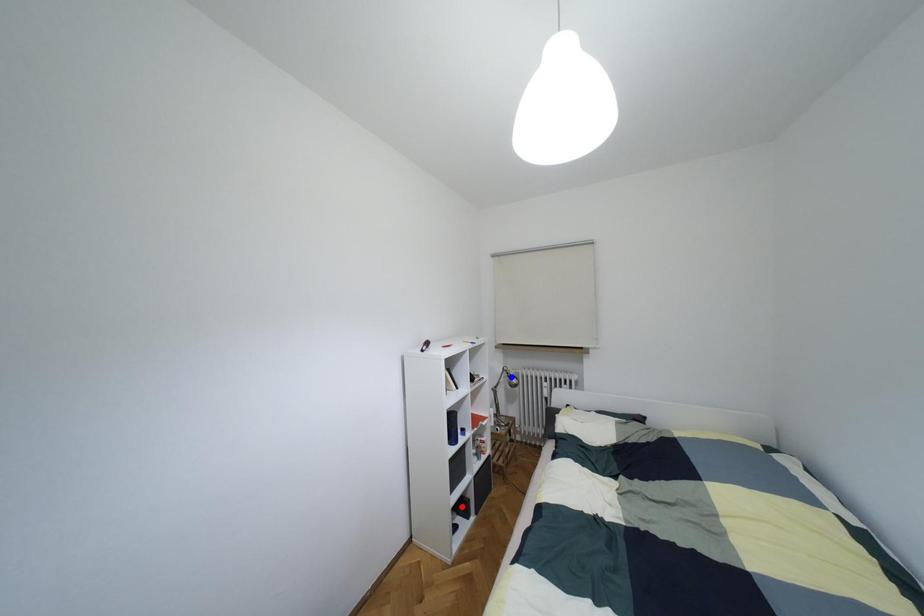
Question: Which of the two points in the image is closer to the camera?

Choices:
 (A) Blue point is closer.
 (B) Red point is closer.

Answer: (B)